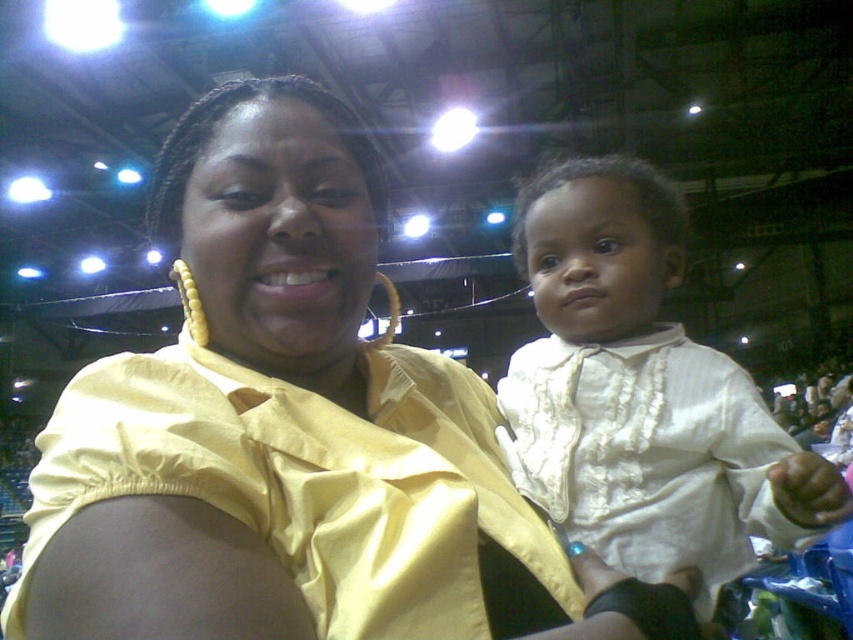
Between point (193, 596) and point (743, 502), which one is positioned behind?

Point (743, 502)

Locate an element on the screen. This screenshot has width=853, height=640. yellow satin shirt at center is located at coordinates (293, 435).

Find the location of a particular element. The width and height of the screenshot is (853, 640). yellow satin shirt at center is located at coordinates (293, 435).